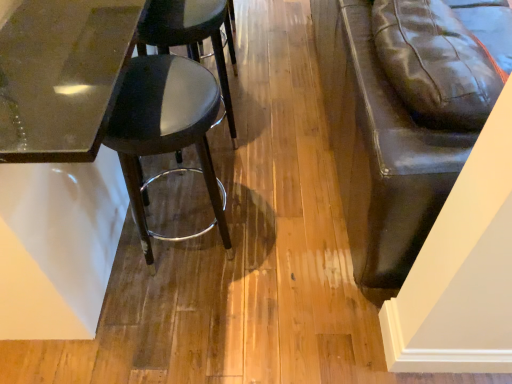
This screenshot has width=512, height=384. What are the coordinates of `vacant space behind matte black stool at left, which is the first stool from bottom to top` in the screenshot? It's located at (215, 178).